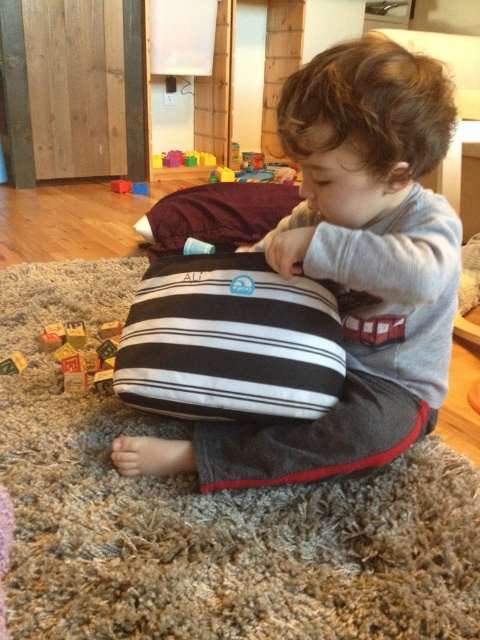
Question: Does black striped cushion at center appear on the left side of black striped pillow at center?

Choices:
 (A) no
 (B) yes

Answer: (A)

Question: Considering the real-world distances, which object is farthest from the black striped pillow at center?

Choices:
 (A) multicolored plastic blocks at upper center
 (B) striped fabric pillow at center
 (C) black striped cushion at center

Answer: (A)

Question: Is striped fabric pillow at center wider than black striped cushion at center?

Choices:
 (A) no
 (B) yes

Answer: (B)

Question: Estimate the real-world distances between objects in this image. Which object is closer to the black striped pillow at center?

Choices:
 (A) striped fabric pillow at center
 (B) wooden blocks at lower left
 (C) multicolored plastic blocks at upper center

Answer: (B)

Question: Can you confirm if black striped cushion at center is smaller than wooden blocks at lower left?

Choices:
 (A) no
 (B) yes

Answer: (A)

Question: Estimate the real-world distances between objects in this image. Which object is closer to the black striped cushion at center?

Choices:
 (A) wooden blocks at lower left
 (B) black striped pillow at center
 (C) striped fabric pillow at center

Answer: (C)